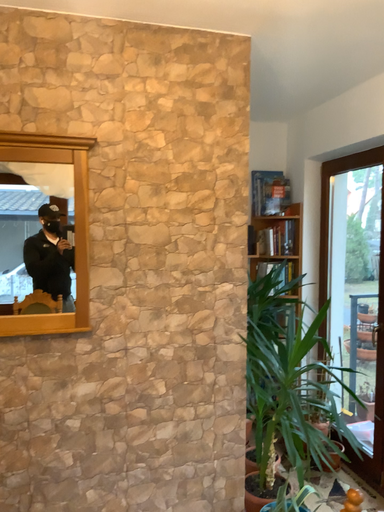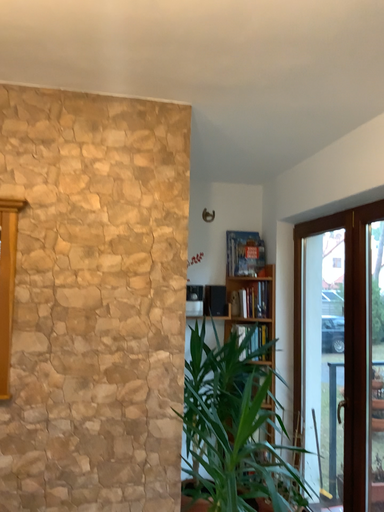
Question: How did the camera likely rotate when shooting the video?

Choices:
 (A) rotated downward
 (B) rotated upward

Answer: (B)